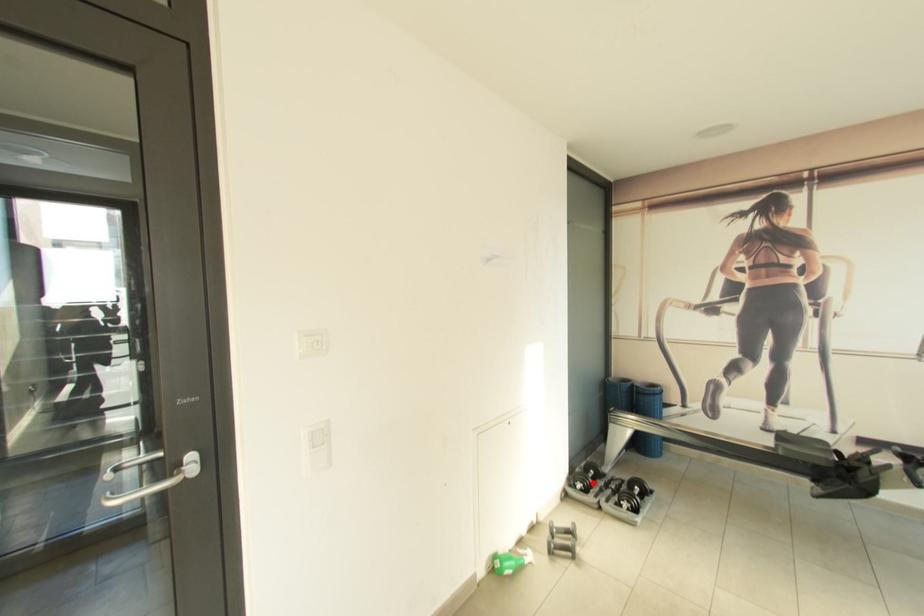
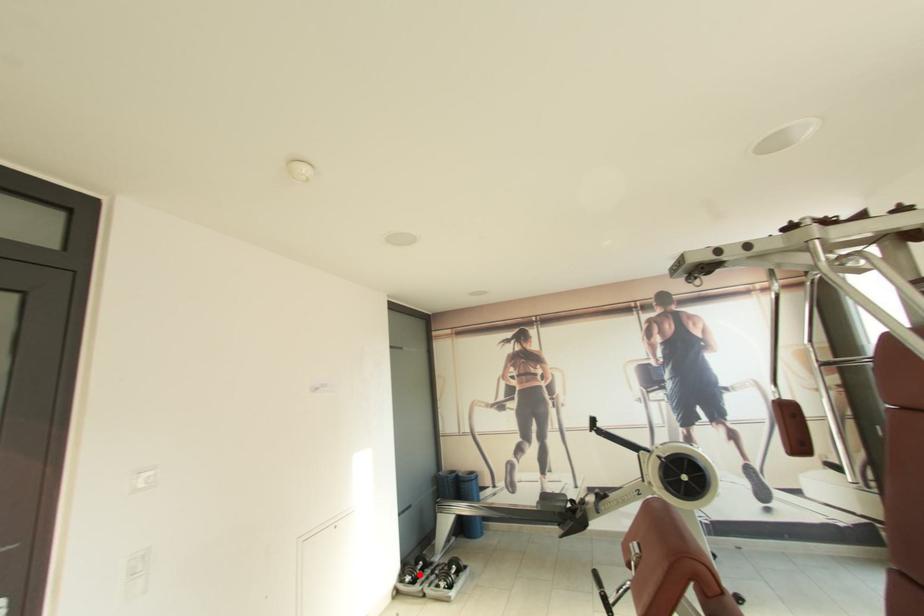
I am providing you with two images of the same scene from different viewpoints. A red point is marked on the first image and another point is marked on the second image. Is the red point in image1 aligned with the point shown in image2?

Yes